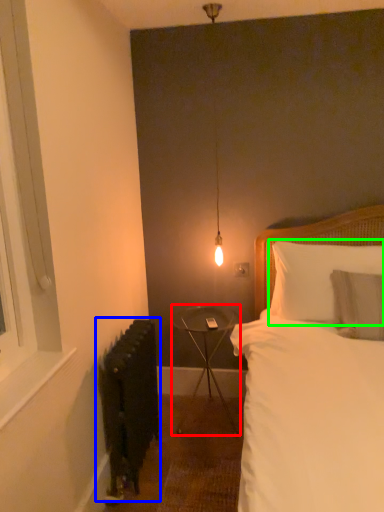
Question: Considering the real-world distances, which object is closest to table (highlighted by a red box)? radiator (highlighted by a blue box) or pillow (highlighted by a green box).

Choices:
 (A) radiator
 (B) pillow

Answer: (A)